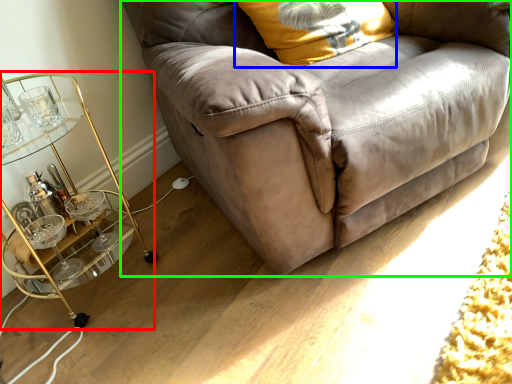
Question: Considering the real-world distances, which object is farthest from table (highlighted by a red box)? pillow (highlighted by a blue box) or studio couch (highlighted by a green box)?

Choices:
 (A) pillow
 (B) studio couch

Answer: (A)